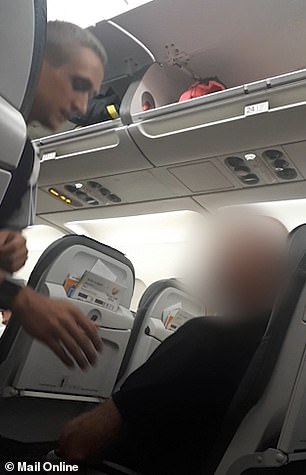
Where is `overhead bin`? The image size is (306, 475). overhead bin is located at coordinates (249, 67), (119, 90).